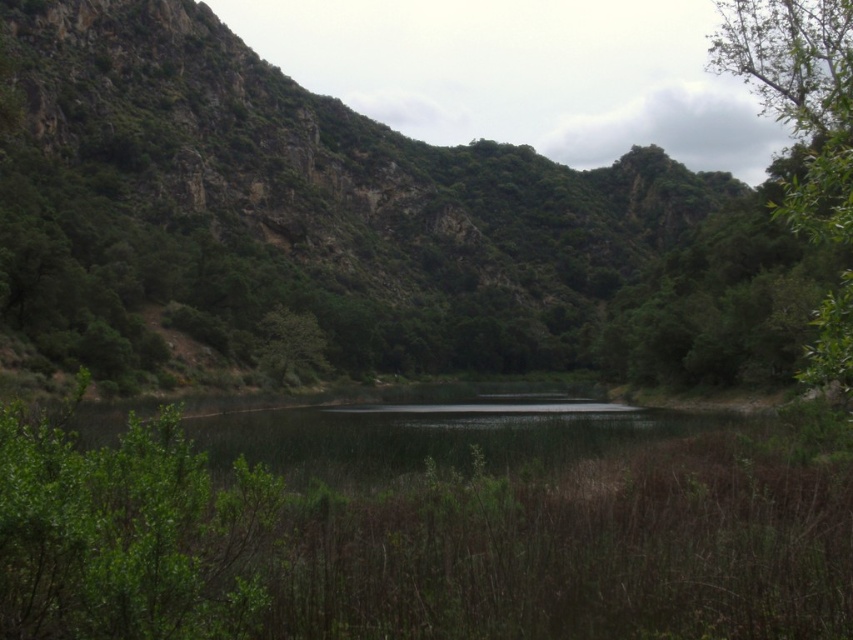
Which is behind, point (108, 497) or point (813, 216)?

The point (813, 216) is behind.

Measure the distance between green leafy bush at center and camera.

A distance of 24.01 meters exists between green leafy bush at center and camera.

In order to click on green leafy bush at center in this screenshot , I will do `click(125, 536)`.

Between green leafy tree at right and green leafy tree at center, which one is positioned lower?

green leafy tree at center is lower down.

You are a GUI agent. You are given a task and a screenshot of the screen. Output one action in this format:
    pyautogui.click(x=<x>, y=<y>)
    Task: Click on the green leafy tree at right
    
    Given the screenshot: What is the action you would take?
    pyautogui.click(x=799, y=97)

Locate an element on the screen. Image resolution: width=853 pixels, height=640 pixels. green leafy tree at right is located at coordinates (799, 97).

Can you confirm if green leafy bush at center is wider than green leafy tree at center?

Yes, green leafy bush at center is wider than green leafy tree at center.

This screenshot has width=853, height=640. I want to click on green leafy bush at center, so click(x=125, y=536).

This screenshot has width=853, height=640. I want to click on green leafy bush at center, so click(125, 536).